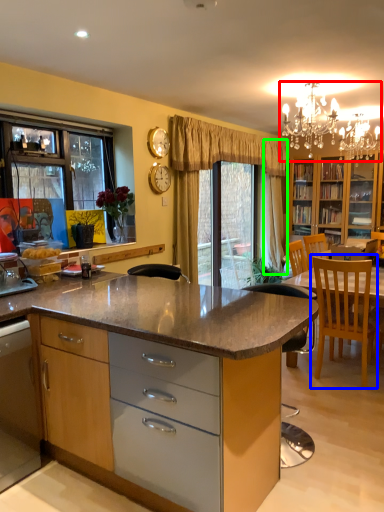
Question: Which is nearer to the light fixture (highlighted by a red box)? chair (highlighted by a blue box) or curtain (highlighted by a green box).

Choices:
 (A) chair
 (B) curtain

Answer: (B)